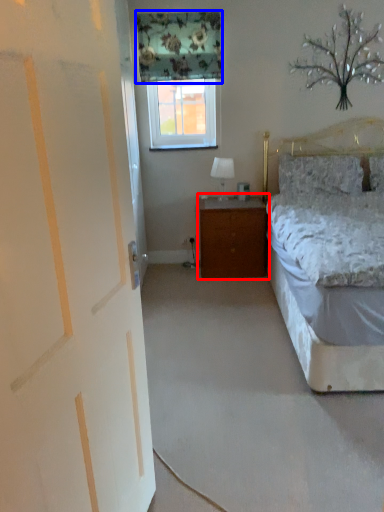
Question: Which object is further to the camera taking this photo, nightstand (highlighted by a red box) or curtain (highlighted by a blue box)?

Choices:
 (A) nightstand
 (B) curtain

Answer: (A)